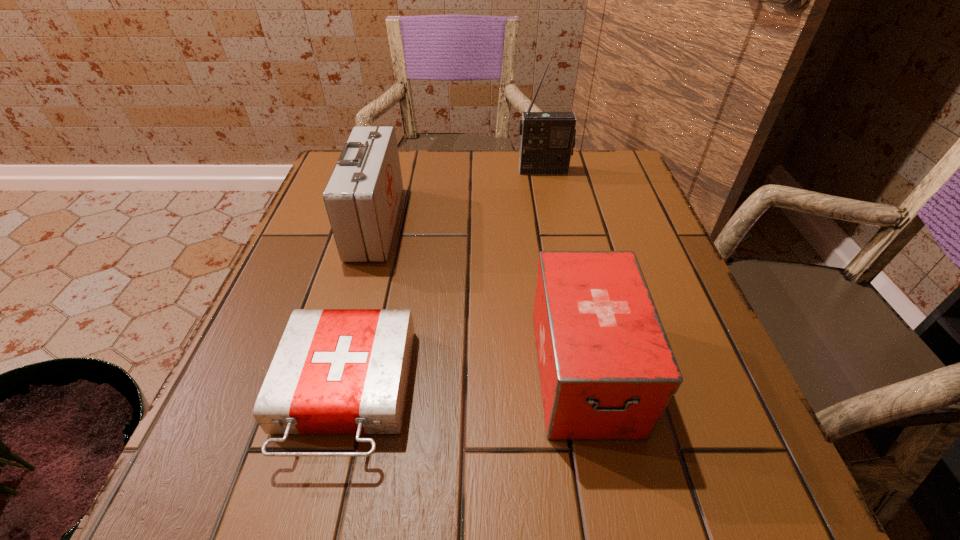
You are a GUI agent. You are given a task and a screenshot of the screen. Output one action in this format:
    pyautogui.click(x=<x>, y=<y>)
    Task: Click on the vacant space at the left edge of the desktop
    
    Given the screenshot: What is the action you would take?
    pyautogui.click(x=300, y=293)

Image resolution: width=960 pixels, height=540 pixels. What are the coordinates of `vacant space at the right edge of the desktop` in the screenshot? It's located at (679, 419).

In the image, there is a desktop. In order to click on free region at the near left corner in this screenshot , I will do `click(279, 501)`.

Where is `free space at the far right corner of the desktop`? Image resolution: width=960 pixels, height=540 pixels. free space at the far right corner of the desktop is located at coordinates (615, 173).

Where is `free spot between the farthest object and the shortest first-aid kit`? Image resolution: width=960 pixels, height=540 pixels. free spot between the farthest object and the shortest first-aid kit is located at coordinates (444, 281).

The height and width of the screenshot is (540, 960). Identify the location of unoccupied position between the second tallest first-aid kit and the farthest first-aid kit. (480, 297).

Identify the location of vacant space that is in between the second farthest object and the shortest object. This screenshot has height=540, width=960. (360, 308).

What are the coordinates of `vacant space that is in between the shortest first-aid kit and the third nearest object` in the screenshot? It's located at (360, 308).

Find the location of `vacant point located between the second shortest object and the farthest first-aid kit`. vacant point located between the second shortest object and the farthest first-aid kit is located at coordinates (480, 297).

Where is `free space that is in between the shortest first-aid kit and the second shortest first-aid kit`? The width and height of the screenshot is (960, 540). free space that is in between the shortest first-aid kit and the second shortest first-aid kit is located at coordinates point(465,381).